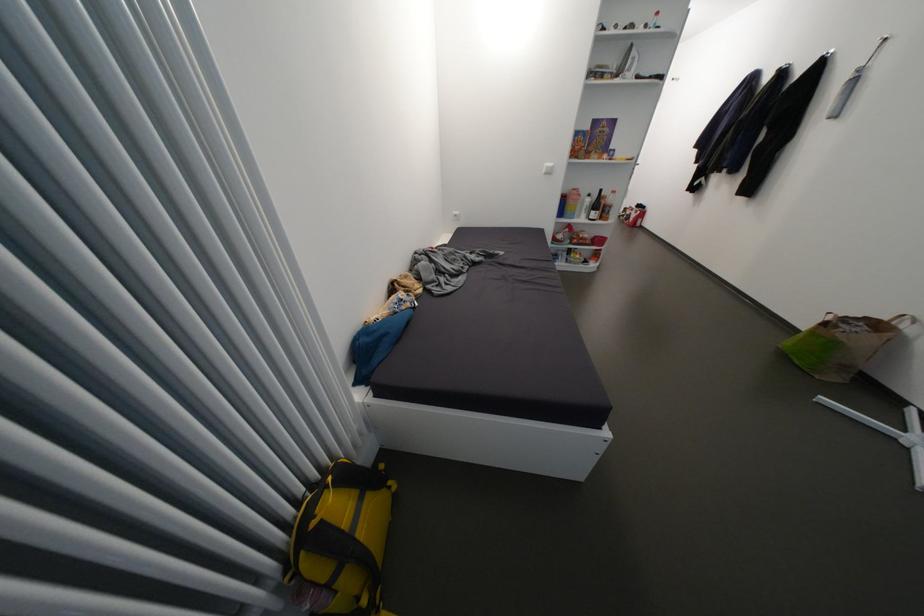
Describe the element at coordinates (878, 47) in the screenshot. I see `the metal wall hook` at that location.